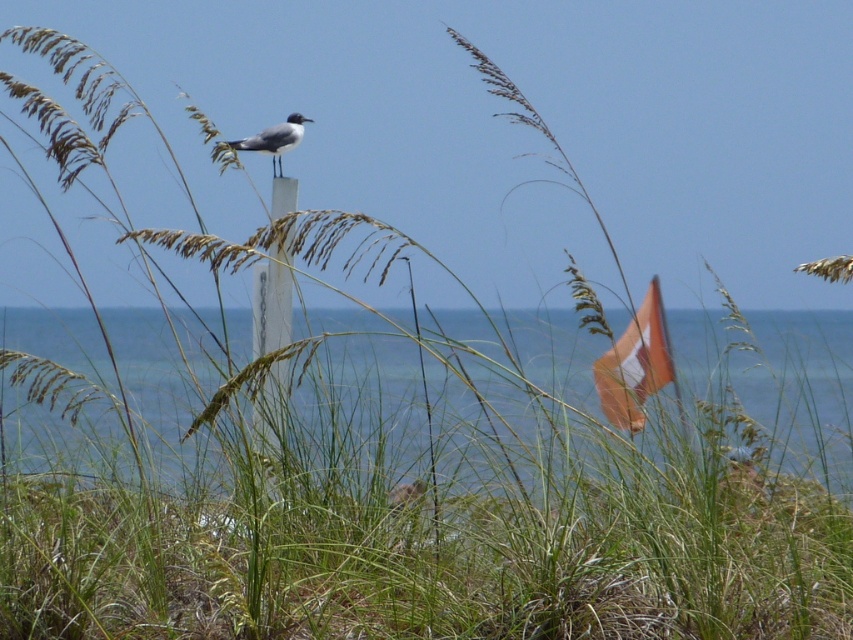
You are standing at the origin point in this coastal scene. There are two points marked on the image, point A at coordinates point A is point [849,490] and point B is point [286,204]. Which point is closer to you?

Point A at coordinates point [849,490] is in front of point B at coordinates point [286,204], so point A is closer to you.